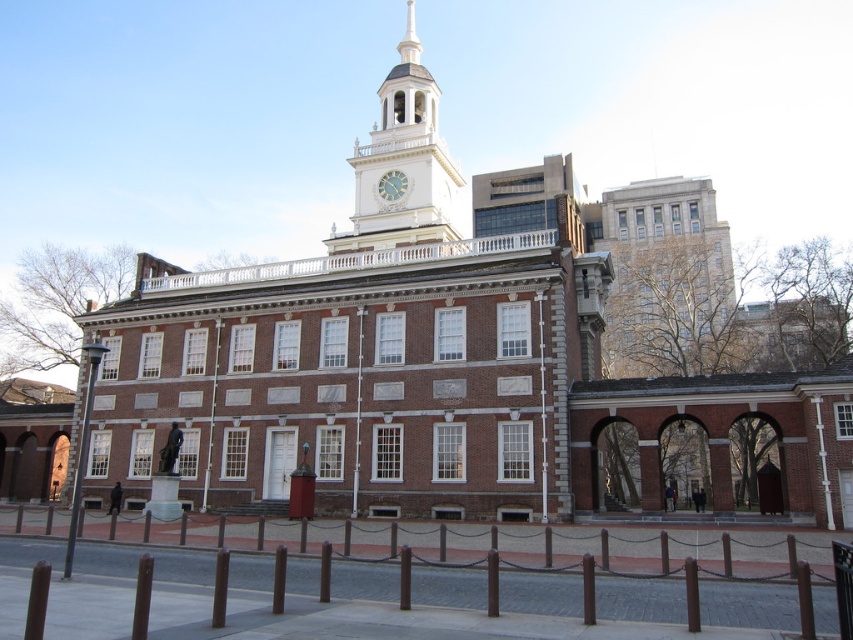
You are standing in front of the historic building and want to take a photo that includes both the white painted wood clock tower at upper center and the matte white clock at center. Which object will appear larger in your photo?

The white painted wood clock tower at upper center will appear larger in the photo because it is closer to the viewer than the matte white clock at center.

You are a tourist standing in front of the historic building and want to take a photo that includes both the white painted wood clock tower at upper center and the matte white clock at center. Which object should you position closer to the edge of the frame to ensure both are fully visible?

Since the white painted wood clock tower at upper center is wider than the matte white clock at center, you should position the wider white painted wood clock tower at upper center closer to the edge of the frame to ensure both are fully visible.